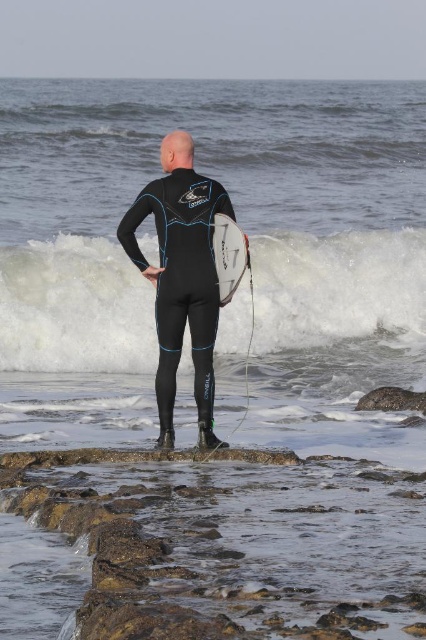
Does black matte wetsuit at center lie behind white matte surfboard at center?

No, black matte wetsuit at center is in front of white matte surfboard at center.

Which is in front, point (169, 304) or point (221, 220)?

Positioned in front is point (169, 304).

Where is `black matte wetsuit at center`? The image size is (426, 640). black matte wetsuit at center is located at coordinates (181, 276).

Find the location of a particular element. This screenshot has height=640, width=426. black matte wetsuit at center is located at coordinates (181, 276).

Is white foam wave at center above white matte surfboard at center?

No, white foam wave at center is not above white matte surfboard at center.

Is white foam wave at center further to camera compared to white matte surfboard at center?

Yes, white foam wave at center is further from the viewer.

Which is in front, point (359, 252) or point (213, 225)?

Positioned in front is point (213, 225).

Identify the location of white foam wave at center. coord(342,300).

This screenshot has height=640, width=426. In order to click on white foam wave at center in this screenshot , I will do pos(342,300).

Consider the image. Can you confirm if white foam wave at center is positioned above black matte wetsuit at center?

No, white foam wave at center is not above black matte wetsuit at center.

Image resolution: width=426 pixels, height=640 pixels. I want to click on white foam wave at center, so click(342, 300).